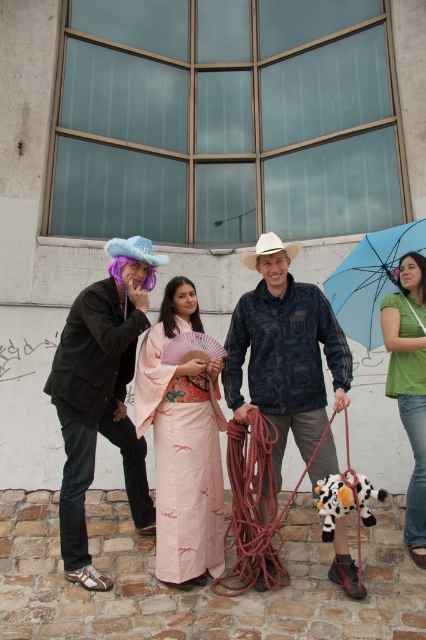
You are standing in front of the large windowed wall and want to know the exact location of the green matte shirt at lower right. Can you tell me its coordinates?

The green matte shirt at lower right is located at coordinates point (x=409, y=385).

You are standing in front of the large windowed wall and want to touch both points marked on the wall. Which point, point (262, 428) or point (336, 484), will you reach first if you move towards the wall?

You will reach point (262, 428) first because it is closer to you than point (336, 484).

You are standing in front of the large windowed wall and want to reach the point marked at coordinates point (389, 310). If you can only move forward in a straight line, will you hit any part of the window panes before reaching that point?

The point (389, 310) is 4.88 meters away from the viewer. Since there are no obstacles mentioned between you and the point, moving forward in a straight line would allow you to reach it without hitting any window panes.